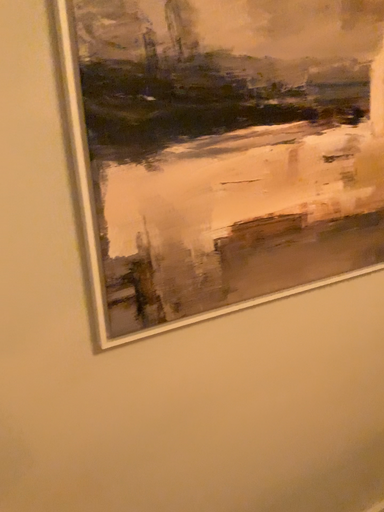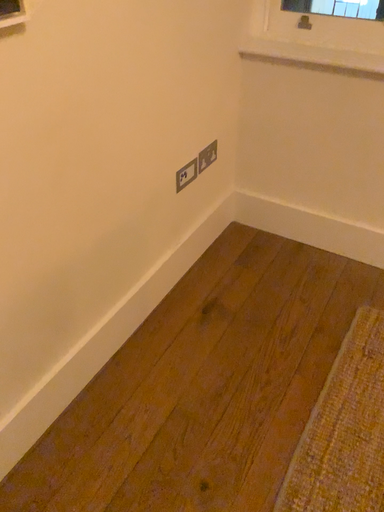
Question: How did the camera likely rotate when shooting the video?

Choices:
 (A) rotated right
 (B) rotated left

Answer: (A)